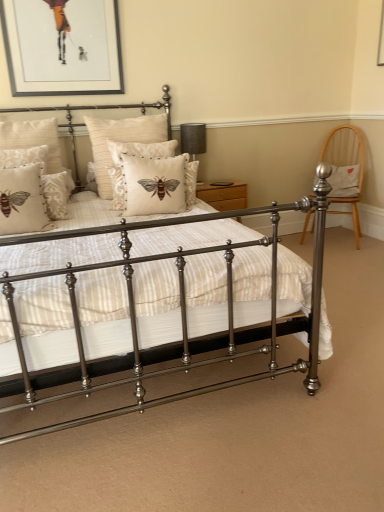
Question: From a real-world perspective, is black fabric table lamp at upper center physically above beige damask pillow at left, which is the first pillow in left-to-right order?

Choices:
 (A) no
 (B) yes

Answer: (A)

Question: Does black fabric table lamp at upper center appear on the left side of beige damask pillow at left, arranged as the seventh pillow when viewed from the right?

Choices:
 (A) yes
 (B) no

Answer: (B)

Question: Can you confirm if black fabric table lamp at upper center is bigger than beige damask pillow at left, which is the first pillow in left-to-right order?

Choices:
 (A) no
 (B) yes

Answer: (A)

Question: From the image's perspective, is black fabric table lamp at upper center below beige damask pillow at left, which is the first pillow in left-to-right order?

Choices:
 (A) no
 (B) yes

Answer: (A)

Question: Is black fabric table lamp at upper center outside of beige damask pillow at left, which is the first pillow in left-to-right order?

Choices:
 (A) yes
 (B) no

Answer: (A)

Question: Does black fabric table lamp at upper center appear on the right side of beige damask pillow at left, arranged as the seventh pillow when viewed from the right?

Choices:
 (A) no
 (B) yes

Answer: (B)

Question: Can you confirm if metallic bed at center is positioned to the left of beige textured pillow at left, which is counted as the 2th pillow, starting from the left?

Choices:
 (A) no
 (B) yes

Answer: (A)

Question: Is metallic bed at center oriented towards beige textured pillow at left, which is the sixth pillow from right to left?

Choices:
 (A) no
 (B) yes

Answer: (A)

Question: From the image's perspective, does metallic bed at center appear lower than beige textured pillow at left, which is the sixth pillow from right to left?

Choices:
 (A) yes
 (B) no

Answer: (A)

Question: From the image's perspective, does metallic bed at center appear higher than beige textured pillow at left, which is counted as the 2th pillow, starting from the left?

Choices:
 (A) no
 (B) yes

Answer: (A)

Question: Does metallic bed at center have a smaller size compared to beige textured pillow at left, which is counted as the 2th pillow, starting from the left?

Choices:
 (A) no
 (B) yes

Answer: (A)

Question: Is metallic bed at center taller than beige textured pillow at left, which is counted as the 2th pillow, starting from the left?

Choices:
 (A) no
 (B) yes

Answer: (B)

Question: Is beige damask pillow at left, arranged as the seventh pillow when viewed from the right, facing away from matte wood nightstand at center?

Choices:
 (A) no
 (B) yes

Answer: (A)